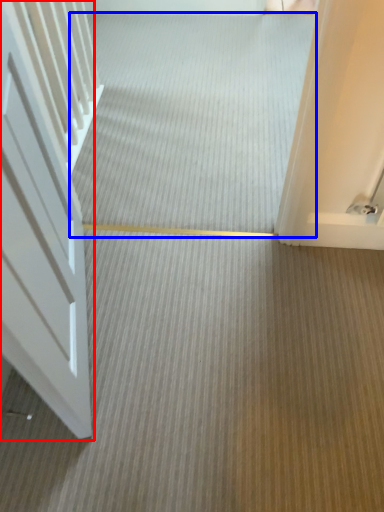
Question: Which object is further to the camera taking this photo, door (highlighted by a red box) or plain (highlighted by a blue box)?

Choices:
 (A) door
 (B) plain

Answer: (B)